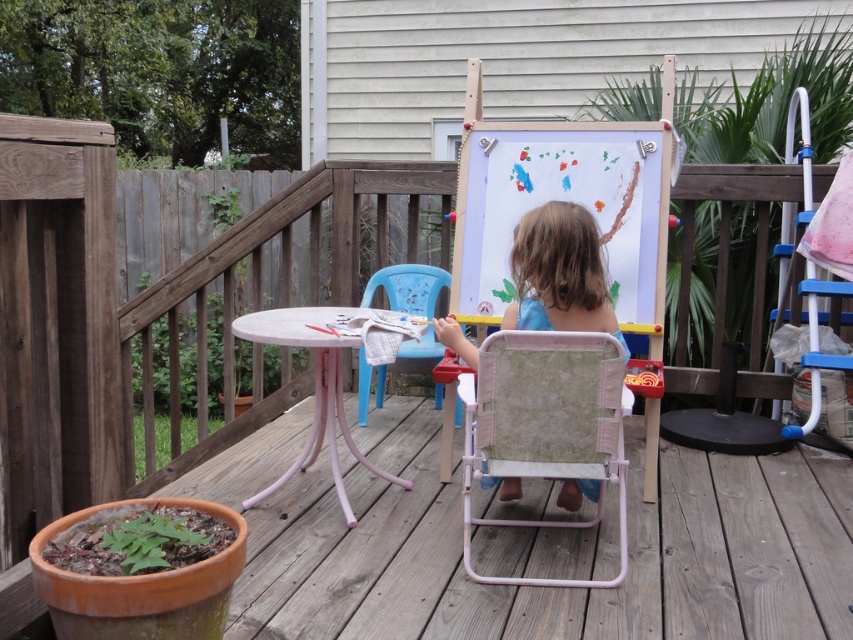
Question: Which point is farther from the camera taking this photo?

Choices:
 (A) (473, 458)
 (B) (521, 291)

Answer: (B)

Question: Is blue cotton shirt at center positioned in front of blue plastic chair at center?

Choices:
 (A) no
 (B) yes

Answer: (B)

Question: Is blue cotton shirt at center positioned at the back of blue plastic chair at center?

Choices:
 (A) yes
 (B) no

Answer: (B)

Question: Can you confirm if pink fabric chair at center is thinner than blue cotton shirt at center?

Choices:
 (A) yes
 (B) no

Answer: (A)

Question: Which object is positioned farthest from the pink fabric chair at center?

Choices:
 (A) blue cotton shirt at center
 (B) blue plastic chair at center

Answer: (B)

Question: Estimate the real-world distances between objects in this image. Which object is closer to the blue plastic chair at center?

Choices:
 (A) pink fabric chair at center
 (B) blue cotton shirt at center

Answer: (B)